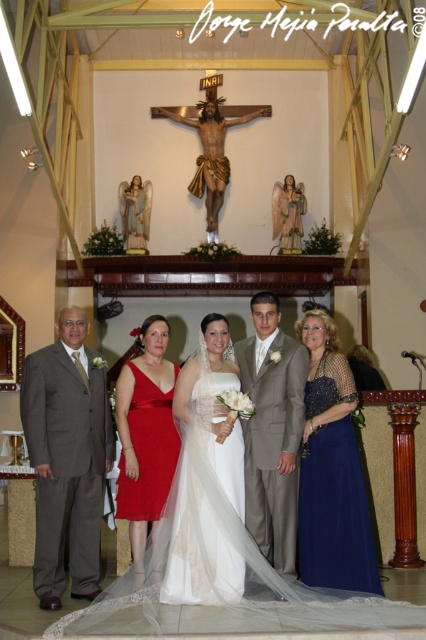
Between shiny blue dress at right and matte red dress at center, which one has more height?

matte red dress at center is taller.

Describe the element at coordinates (331, 470) in the screenshot. I see `shiny blue dress at right` at that location.

This screenshot has width=426, height=640. I want to click on shiny blue dress at right, so click(331, 470).

Consider the image. Measure the distance between matte gray suit at left and camera.

The distance of matte gray suit at left from camera is 13.59 meters.

Can you confirm if matte gray suit at left is positioned above wooden crucifix at center?

No, matte gray suit at left is not above wooden crucifix at center.

Between point (37, 456) and point (201, 140), which one is positioned in front?

Point (37, 456)

What are the coordinates of `matte gray suit at left` in the screenshot? It's located at (66, 458).

Which is in front, point (36, 456) or point (184, 564)?

Point (184, 564) is in front.

Between matte gray suit at left and white tulle dress at center, which one has less height?

white tulle dress at center

Is point (63, 346) more distant than point (210, 492)?

Yes.

This screenshot has height=640, width=426. Identify the location of matte gray suit at left. (66, 458).